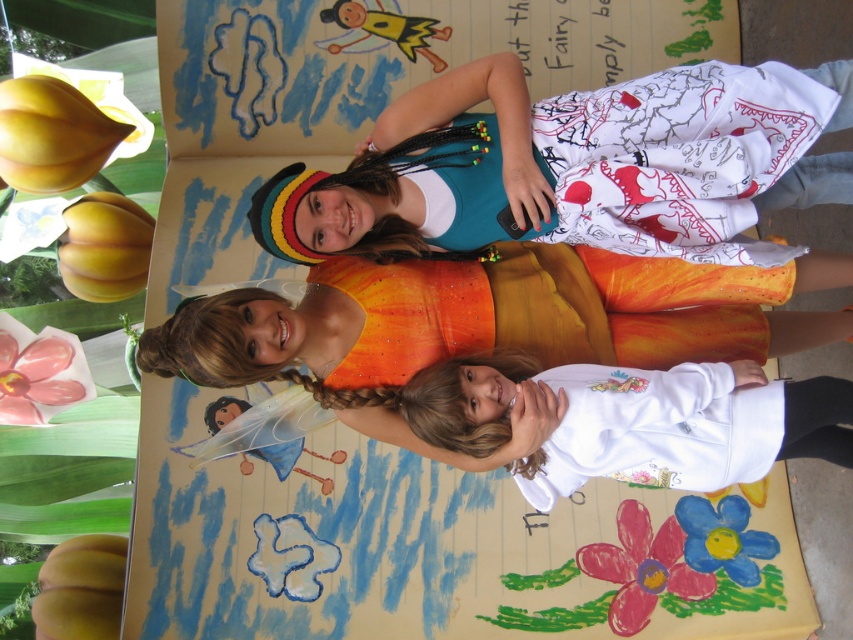
Which is more to the left, shiny orange fabric dress at center or pink glossy flower at upper left?

Positioned to the left is pink glossy flower at upper left.

Is point (766, 340) farther from viewer compared to point (39, 362)?

No, (766, 340) is closer to viewer.

What do you see at coordinates (550, 308) in the screenshot? I see `shiny orange fabric dress at center` at bounding box center [550, 308].

Identify the location of shiny orange fabric dress at center. This screenshot has width=853, height=640. [x=550, y=308].

Consider the image. Who is shorter, white printed dress at center or white fleece sweatshirt at center?

Standing shorter between the two is white fleece sweatshirt at center.

Is point (549, 193) positioned before point (604, 472)?

Yes, point (549, 193) is closer to viewer.

Locate an element on the screen. Image resolution: width=853 pixels, height=640 pixels. white printed dress at center is located at coordinates (573, 166).

The height and width of the screenshot is (640, 853). Find the location of `white printed dress at center`. white printed dress at center is located at coordinates (573, 166).

Is pink glossy flower at upper left above blue painted flower at center?

Indeed, pink glossy flower at upper left is positioned over blue painted flower at center.

Can you confirm if pink glossy flower at upper left is taller than blue painted flower at center?

Yes.

At what (x,y) coordinates should I click in order to perform the action: click on pink glossy flower at upper left. Please return your answer as a coordinate pair (x, y). This screenshot has height=640, width=853. Looking at the image, I should click on (39, 372).

You are a GUI agent. You are given a task and a screenshot of the screen. Output one action in this format:
    pyautogui.click(x=<x>, y=<y>)
    Task: Click on the pink glossy flower at upper left
    The image size is (853, 640).
    Given the screenshot: What is the action you would take?
    pyautogui.click(x=39, y=372)